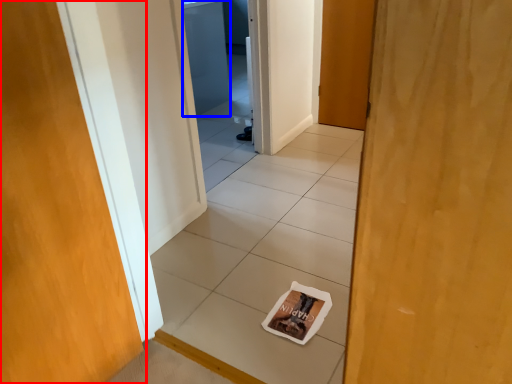
Question: Which object is closer to the camera taking this photo, door (highlighted by a red box) or screen door (highlighted by a blue box)?

Choices:
 (A) door
 (B) screen door

Answer: (A)